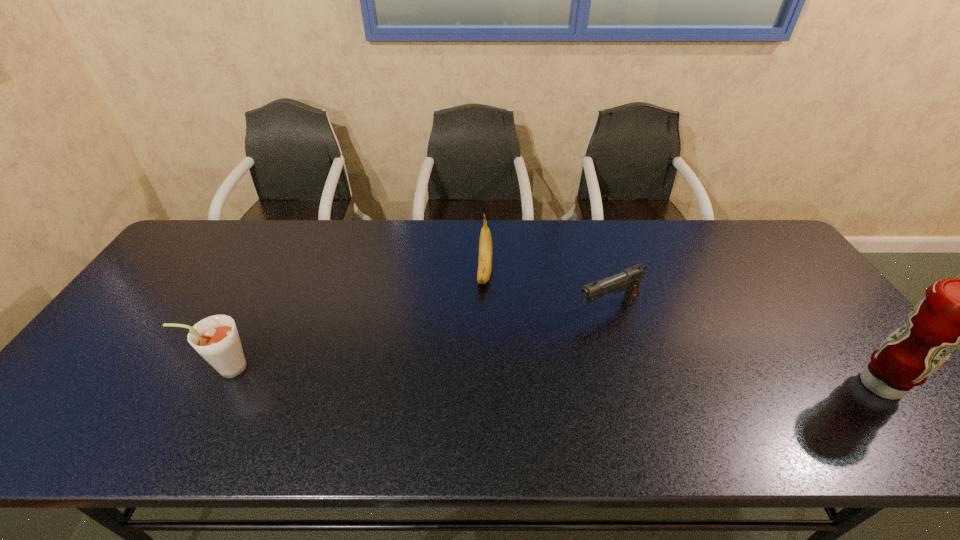
Where is `vacant space located 0.200m on the left of the rightmost object`? The height and width of the screenshot is (540, 960). vacant space located 0.200m on the left of the rightmost object is located at coordinates (767, 385).

The height and width of the screenshot is (540, 960). I want to click on vacant space situated 0.300m in the direction the gun is aimed, so click(x=484, y=357).

You are a GUI agent. You are given a task and a screenshot of the screen. Output one action in this format:
    pyautogui.click(x=<x>, y=<y>)
    Task: Click on the blank space located in the direction the gun is aimed
    The height and width of the screenshot is (540, 960).
    Given the screenshot: What is the action you would take?
    534,335

This screenshot has height=540, width=960. What are the coordinates of `vacant space located in the direction the gun is aimed` in the screenshot? It's located at (463, 366).

Where is `free space located 0.090m at the start of the peel on the second object from left to right`? This screenshot has width=960, height=540. free space located 0.090m at the start of the peel on the second object from left to right is located at coordinates (483, 315).

Where is `vacant space located at the start of the peel on the second object from left to right`? vacant space located at the start of the peel on the second object from left to right is located at coordinates (478, 362).

This screenshot has height=540, width=960. I want to click on free space located 0.380m at the start of the peel on the second object from left to right, so click(x=474, y=408).

Locate an element on the screen. This screenshot has width=960, height=540. object present at the far edge is located at coordinates (485, 242).

Locate an element on the screen. This screenshot has height=540, width=960. root beer situated at the near edge is located at coordinates 216,338.

I want to click on condiment at the near edge, so click(x=956, y=312).